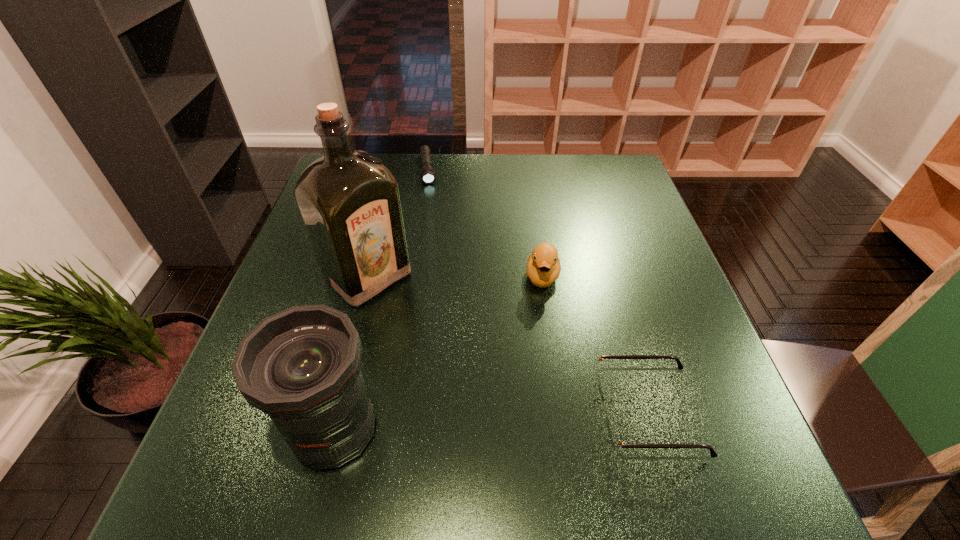
Find the location of a particular element. The image size is (960, 540). vacant space at the near edge of the desktop is located at coordinates tap(590, 402).

Locate an element on the screen. This screenshot has width=960, height=540. free space at the left edge of the desktop is located at coordinates (330, 292).

You are a GUI agent. You are given a task and a screenshot of the screen. Output one action in this format:
    pyautogui.click(x=<x>, y=<y>)
    Task: Click on the blank space at the right edge of the desktop
    The height and width of the screenshot is (540, 960).
    Given the screenshot: What is the action you would take?
    tap(664, 312)

In the image, there is a desktop. Identify the location of free space at the near left corner. The image size is (960, 540). (283, 438).

In order to click on empty space that is in between the duckling and the tallest object in this screenshot , I will do `click(455, 276)`.

Locate an element on the screen. The image size is (960, 540). vacant area that lies between the second shortest object and the telephoto lens is located at coordinates 491,421.

Locate an element on the screen. The image size is (960, 540). vacant region between the shortest object and the telephoto lens is located at coordinates (381, 300).

Where is `unoccupied area between the spectacles and the flashlight`? unoccupied area between the spectacles and the flashlight is located at coordinates (538, 291).

Where is `empty space between the tallest object and the second shortest object`? The width and height of the screenshot is (960, 540). empty space between the tallest object and the second shortest object is located at coordinates (507, 345).

This screenshot has width=960, height=540. What are the coordinates of `empty location between the telephoto lens and the rightmost object` in the screenshot? It's located at (491, 421).